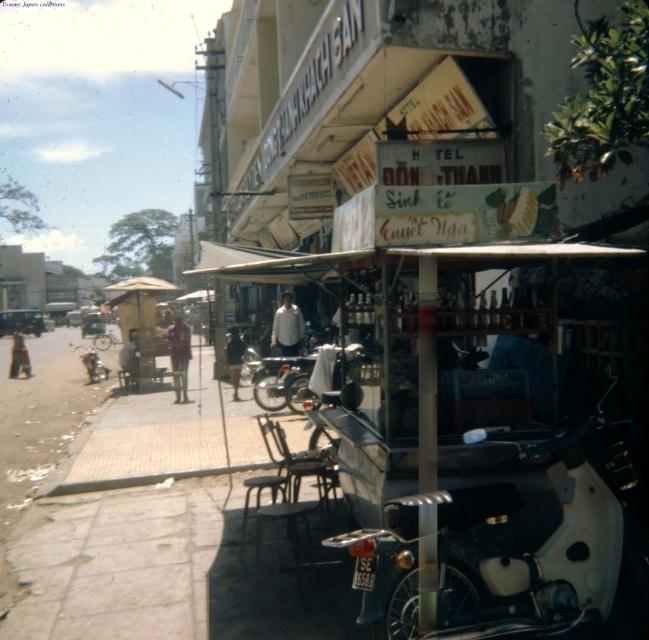
You are a delivery person standing at the scooter parked in front of the stall. You need to hand over a package to the person wearing the white matte shirt at center. However, there is a dark brown leather jacket at center in the way. Can you reach the person without moving the jacket?

The distance between the white matte shirt at center and the dark brown leather jacket at center is 5.09 feet. Since the jacket is between you and the shirt, you would need to move it to reach the person.

You are a customer at the food stall and want to choose between the white matte shirt at center and the purple fabric shirt at center. Which shirt is narrower in width?

The white matte shirt at center is thinner than the purple fabric shirt at center, so the white matte shirt at center is narrower in width.

In the scene shown: You are a delivery person who needs to pick up a package from the food stall. The stall has a counter with items displayed. Can you see the counter clearly from your current position in front of the white matte motorcycle at center and purple fabric shirt at center?

The white matte motorcycle at center is shorter than the purple fabric shirt at center, so the motorcycle does not block your view of the counter. However, the purple fabric shirt at center might be worn by someone standing in front of the counter, potentially obstructing your view.